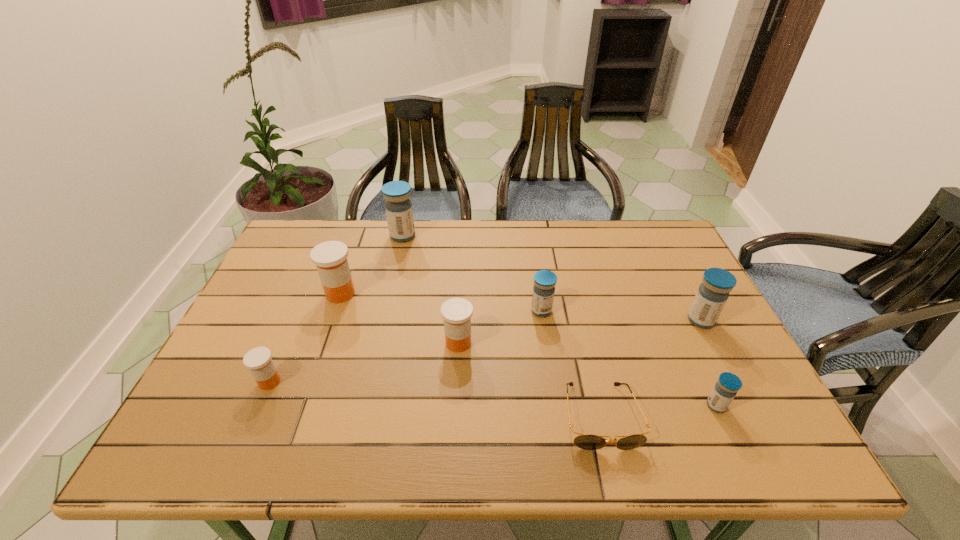
Image resolution: width=960 pixels, height=540 pixels. I want to click on free space between the sunglasses and the leftmost object, so click(435, 399).

Locate an element on the screen. This screenshot has width=960, height=540. vacant point located between the third medicine from right to left and the second biggest blue medicine is located at coordinates [621, 315].

You are a GUI agent. You are given a task and a screenshot of the screen. Output one action in this format:
    pyautogui.click(x=<x>, y=<y>)
    Task: Click on the free space between the second orange medicine from right to left and the smallest blue medicine
    
    Given the screenshot: What is the action you would take?
    pyautogui.click(x=528, y=349)

Where is `vacant point located between the tallest object and the second orange medicine from left to right`? The width and height of the screenshot is (960, 540). vacant point located between the tallest object and the second orange medicine from left to right is located at coordinates (372, 265).

This screenshot has height=540, width=960. Identify the location of vacant space that is in between the third smallest blue medicine and the black sunglasses. (651, 368).

Locate an element on the screen. The height and width of the screenshot is (540, 960). free space that is in between the second object from left to right and the leftmost object is located at coordinates (305, 338).

Image resolution: width=960 pixels, height=540 pixels. I want to click on vacant point located between the biggest orange medicine and the leftmost orange medicine, so click(x=305, y=338).

Locate an element on the screen. free spot between the leftmost medicine and the fourth medicine from right to left is located at coordinates (364, 362).

Where is `vacant space in between the shortest object and the second medicine from left to right`? vacant space in between the shortest object and the second medicine from left to right is located at coordinates (470, 355).

The image size is (960, 540). Find the location of `vacant area that lies between the fifth object from right to left and the black sunglasses`. vacant area that lies between the fifth object from right to left and the black sunglasses is located at coordinates (529, 380).